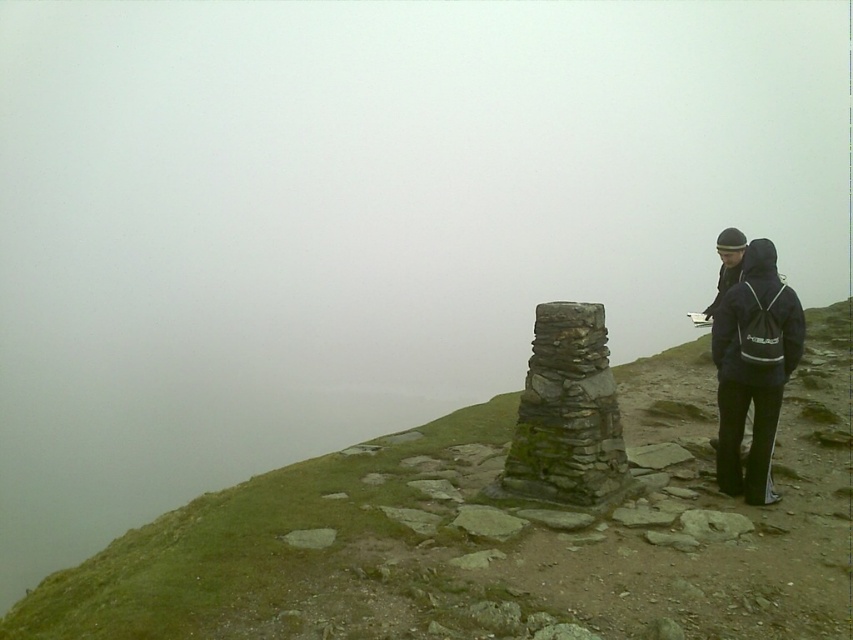
Looking at this image, is the position of green mossy stone stack at center less distant than that of dark blue fleece jacket at right?

No, it is not.

Does green mossy stone stack at center appear over dark blue fleece jacket at right?

No.

You are a GUI agent. You are given a task and a screenshot of the screen. Output one action in this format:
    pyautogui.click(x=<x>, y=<y>)
    Task: Click on the green mossy stone stack at center
    Image resolution: width=853 pixels, height=640 pixels.
    Given the screenshot: What is the action you would take?
    pyautogui.click(x=567, y=412)

What are the coordinates of `green mossy stone stack at center` in the screenshot? It's located at (567, 412).

Is green mossy stone at center wider than dark blue fleece jacket at right?

Yes, green mossy stone at center is wider than dark blue fleece jacket at right.

In the scene shown: Does green mossy stone at center have a smaller size compared to dark blue fleece jacket at right?

Actually, green mossy stone at center might be larger than dark blue fleece jacket at right.

Describe the element at coordinates (496, 534) in the screenshot. I see `green mossy stone at center` at that location.

Image resolution: width=853 pixels, height=640 pixels. In order to click on green mossy stone at center in this screenshot , I will do `click(496, 534)`.

Which is behind, point (759, 561) or point (573, 387)?

The point (573, 387) is behind.

Who is lower down, green mossy stone at center or green mossy stone stack at center?

green mossy stone at center

Between point (334, 632) and point (614, 396), which one is positioned in front?

Point (334, 632) is in front.

The image size is (853, 640). Identify the location of green mossy stone at center. (496, 534).